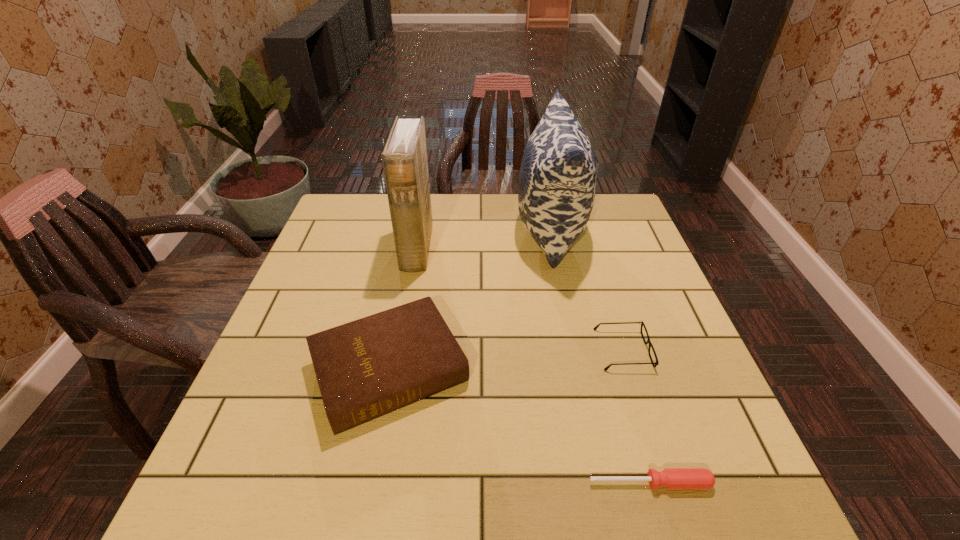
At what (x,y) coordinates should I click in order to perform the action: click on free space located 0.080m on the front-facing side of the spectacles. Please return your answer as a coordinate pair (x, y). The height and width of the screenshot is (540, 960). Looking at the image, I should click on (684, 349).

At what (x,y) coordinates should I click in order to perform the action: click on free space located 0.210m on the left of the screwdriver. Please return your answer as a coordinate pair (x, y). Image resolution: width=960 pixels, height=540 pixels. Looking at the image, I should click on (x=468, y=483).

Find the location of `cushion present at the far edge`. cushion present at the far edge is located at coordinates (557, 182).

Find the location of a particular element. phonebook that is at the far edge is located at coordinates (404, 158).

Where is `object situated at the near edge`? object situated at the near edge is located at coordinates (670, 478).

You are a GUI agent. You are given a task and a screenshot of the screen. Output one action in this format:
    pyautogui.click(x=<x>, y=<y>)
    Task: Click on the object present at the left edge
    Image resolution: width=960 pixels, height=540 pixels.
    Given the screenshot: What is the action you would take?
    pyautogui.click(x=367, y=368)

Identify the location of cushion present at the right edge. (557, 182).

Find the location of `spectacles that is at the right edge`. spectacles that is at the right edge is located at coordinates (642, 323).

Find the location of a particular element. screwdriver situated at the right edge is located at coordinates (670, 478).

This screenshot has width=960, height=540. Find the location of `object present at the far right corner`. object present at the far right corner is located at coordinates (557, 182).